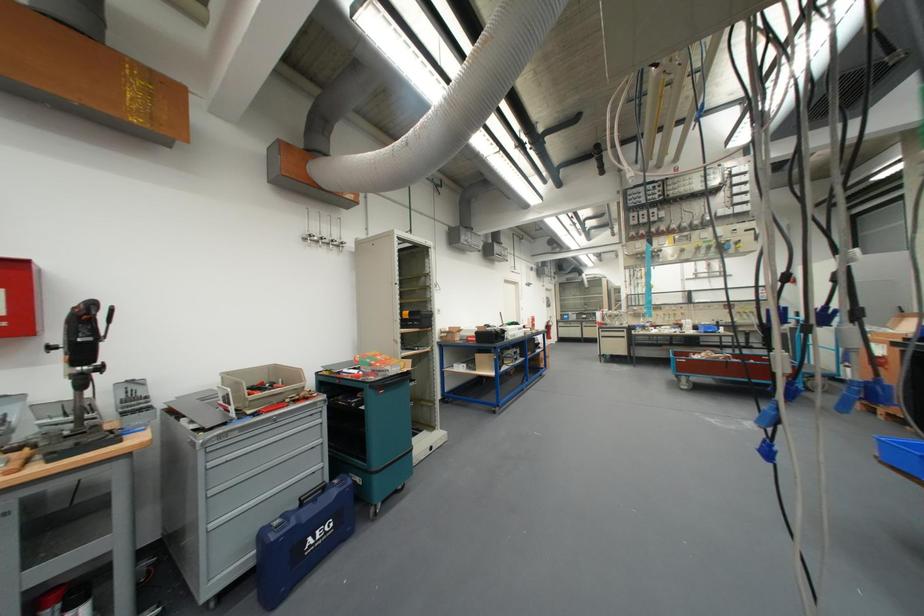
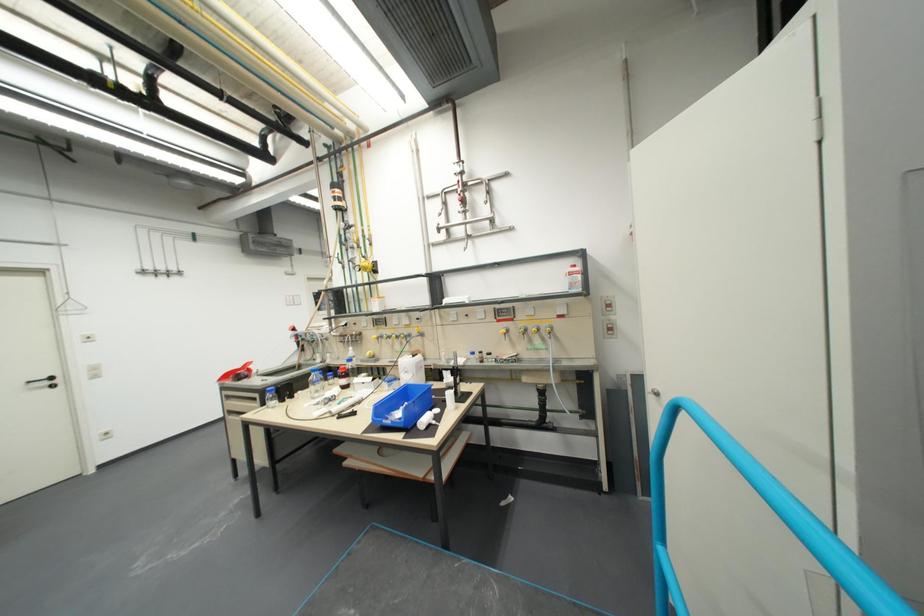
Locate, in the second image, the point that corresponds to [652,291] in the first image.

(373, 278)